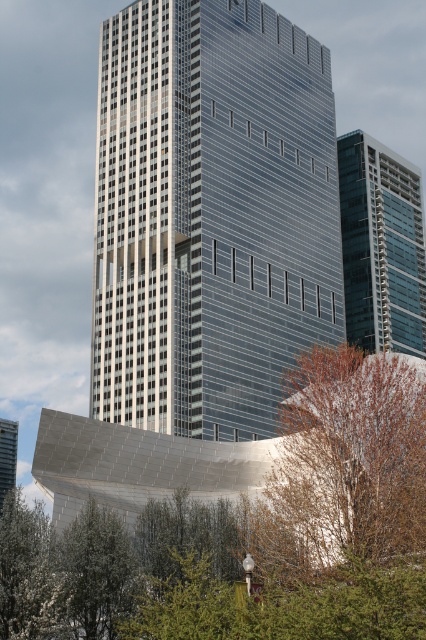
You are standing in the urban landscape scene and want to determine which of the two points, point [362,260] or point [11,470], is nearer to you. Based on the spatial arrangement in the image, which point is closer?

Point [362,260] is closer to the viewer than point [11,470].